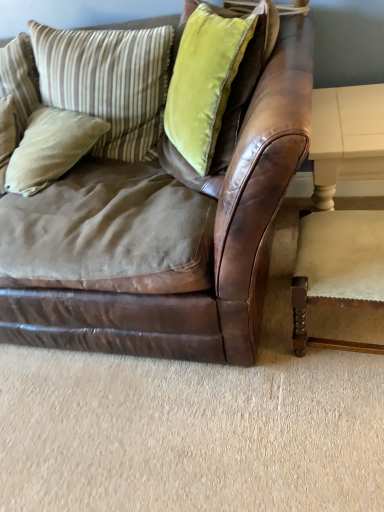
Question: From the image's perspective, is white painted wood table at right positioned above or below brown leather couch at center?

Choices:
 (A) above
 (B) below

Answer: (B)

Question: From their relative heights in the image, would you say white painted wood table at right is taller or shorter than brown leather couch at center?

Choices:
 (A) tall
 (B) short

Answer: (B)

Question: Based on their relative distances, which object is farther from the velvet green pillow at upper center, the first pillow when ordered from right to left?

Choices:
 (A) striped fabric pillow at upper left, which ranks as the 2th pillow in right-to-left order
 (B) beige cotton pillow at left, which is counted as the third pillow, starting from the right
 (C) striped fabric pillow at upper left, which ranks as the 4th pillow in right-to-left order
 (D) white painted wood table at right
 (E) brown leather couch at center

Answer: (C)

Question: Which of these objects is positioned closest to the beige cotton pillow at left, the 2th pillow viewed from the left?

Choices:
 (A) white painted wood table at right
 (B) striped fabric pillow at upper left, which is counted as the 1th pillow, starting from the left
 (C) velvet green pillow at upper center, which is the 4th pillow from left to right
 (D) beige fabric chair at lower right
 (E) brown leather couch at center

Answer: (B)